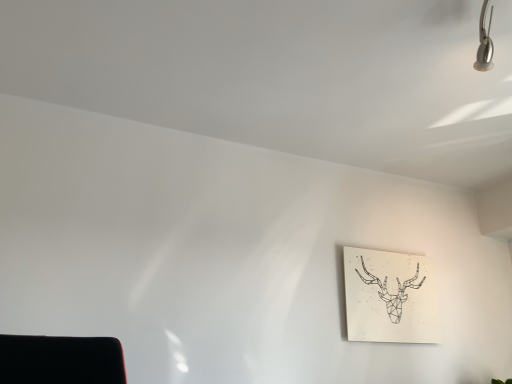
What do you see at coordinates (389, 297) in the screenshot?
I see `white paper at upper right` at bounding box center [389, 297].

Locate an element on the screen. The width and height of the screenshot is (512, 384). white paper at upper right is located at coordinates (389, 297).

Where is `white paper at upper right`? The width and height of the screenshot is (512, 384). white paper at upper right is located at coordinates (389, 297).